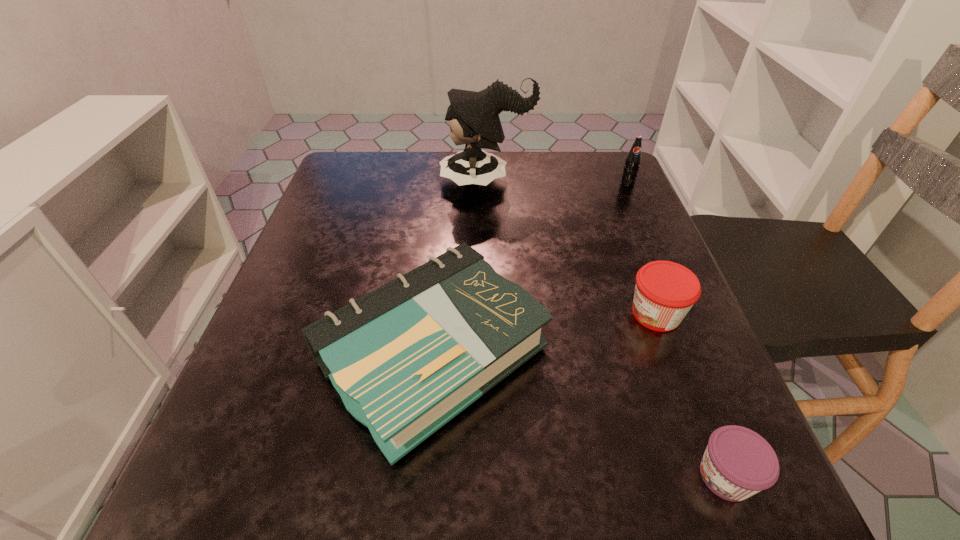
Locate an element on the screen. This screenshot has height=540, width=960. doll is located at coordinates (473, 117).

Image resolution: width=960 pixels, height=540 pixels. What are the coordinates of `pop` in the screenshot? It's located at (632, 162).

The height and width of the screenshot is (540, 960). Find the location of `paperback book`. paperback book is located at coordinates (406, 358).

At what (x,y) coordinates should I click in order to perform the action: click on the taller jam. Please return your answer as a coordinate pair (x, y). This screenshot has height=540, width=960. Looking at the image, I should click on (665, 291).

I want to click on the shorter jam, so click(738, 463).

The height and width of the screenshot is (540, 960). Find the location of `the nearer jam`. the nearer jam is located at coordinates (738, 463).

What are the coordinates of `free location located 0.270m at the face of the tallest object` in the screenshot? It's located at (331, 181).

Find the location of a particular element. The height and width of the screenshot is (540, 960). free point located at the face of the tallest object is located at coordinates (412, 181).

This screenshot has height=540, width=960. I want to click on vacant space located at the face of the tallest object, so click(x=368, y=181).

The height and width of the screenshot is (540, 960). What are the coordinates of `free space located 0.220m on the front label of the pop` in the screenshot? It's located at (655, 245).